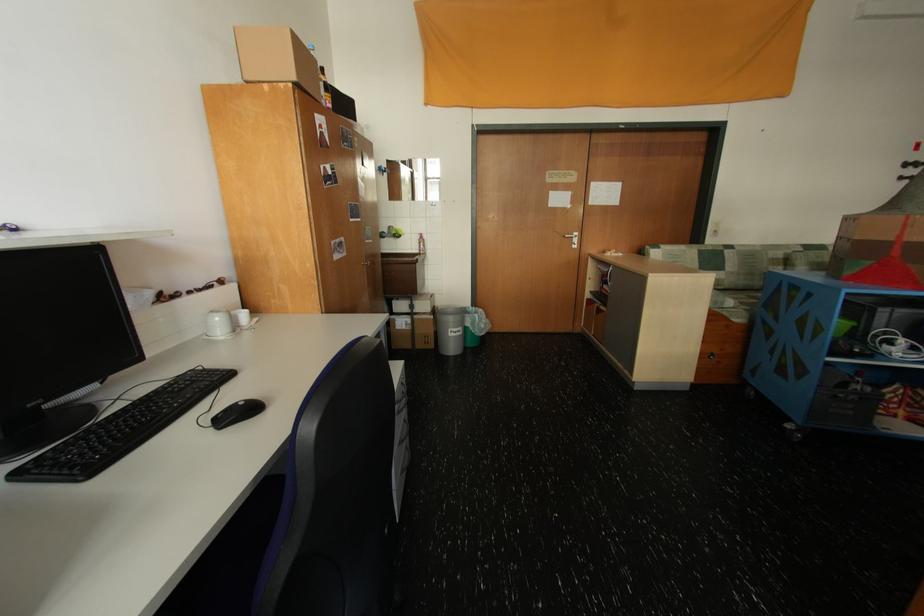
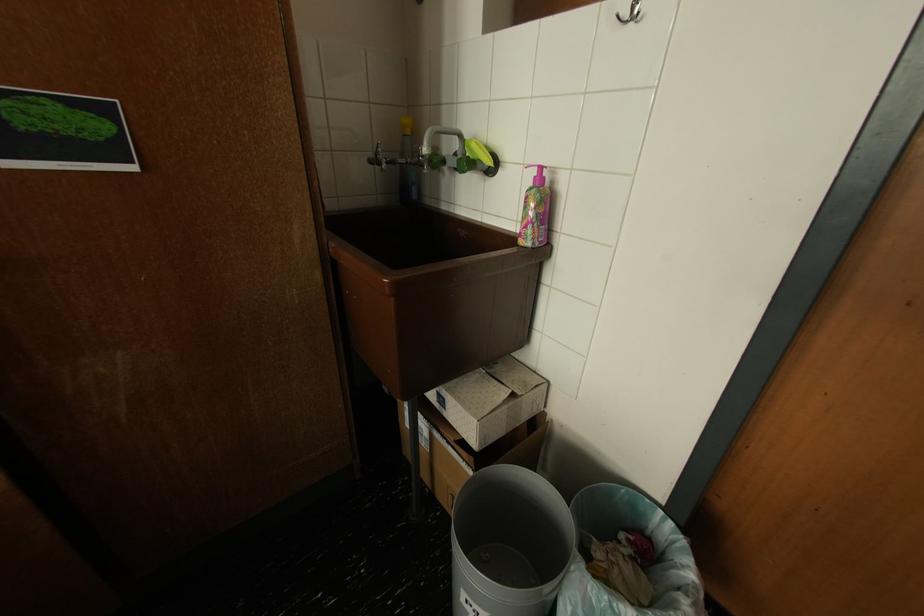
Where in the second image is the point corresponding to pixel 429 252 from the first image?

(529, 235)